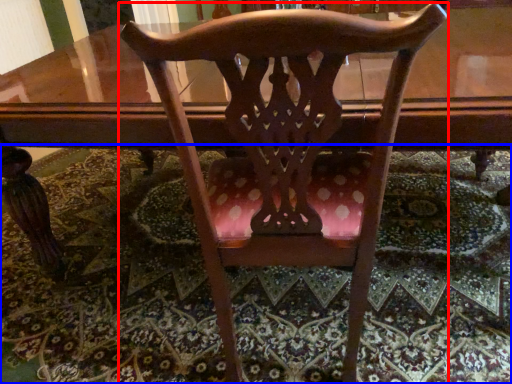
Question: Which object appears closest to the camera in this image, chair (highlighted by a red box) or mat (highlighted by a blue box)?

Choices:
 (A) chair
 (B) mat

Answer: (A)